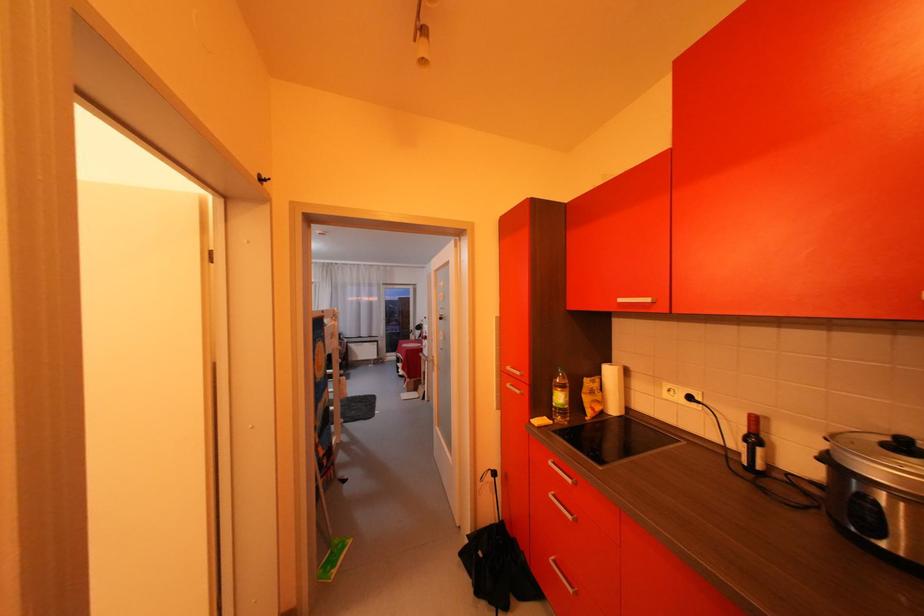
The location [560,397] corresponds to which object?

It corresponds to the green glass bottle in the image.